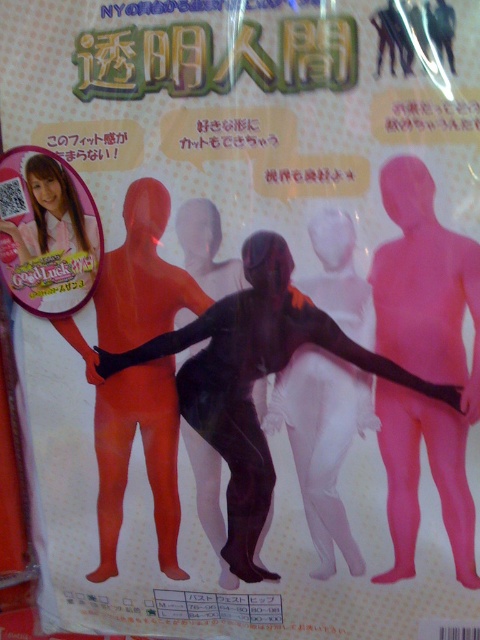
Who is shorter, pink matte bodysuit at center or matte orange spandex at center?

pink matte bodysuit at center

Is point (412, 208) positioned before point (118, 509)?

That is True.

Locate an element on the screen. pink matte bodysuit at center is located at coordinates (424, 364).

Can you confirm if black spandex suit at center is positioned to the right of black matte bodysuit at center?

In fact, black spandex suit at center is to the left of black matte bodysuit at center.

Can you confirm if black spandex suit at center is shorter than black matte bodysuit at center?

Yes, black spandex suit at center is shorter than black matte bodysuit at center.

Between point (216, 442) and point (344, 454), which one is positioned behind?

The point (216, 442) is more distant.

I want to click on black spandex suit at center, so click(x=253, y=380).

Can you confirm if pink matte bodysuit at center is shorter than black matte bodysuit at center?

In fact, pink matte bodysuit at center may be taller than black matte bodysuit at center.

Which is behind, point (445, 376) or point (342, 321)?

Positioned behind is point (342, 321).

Locate an element on the screen. The width and height of the screenshot is (480, 640). pink matte bodysuit at center is located at coordinates (424, 364).